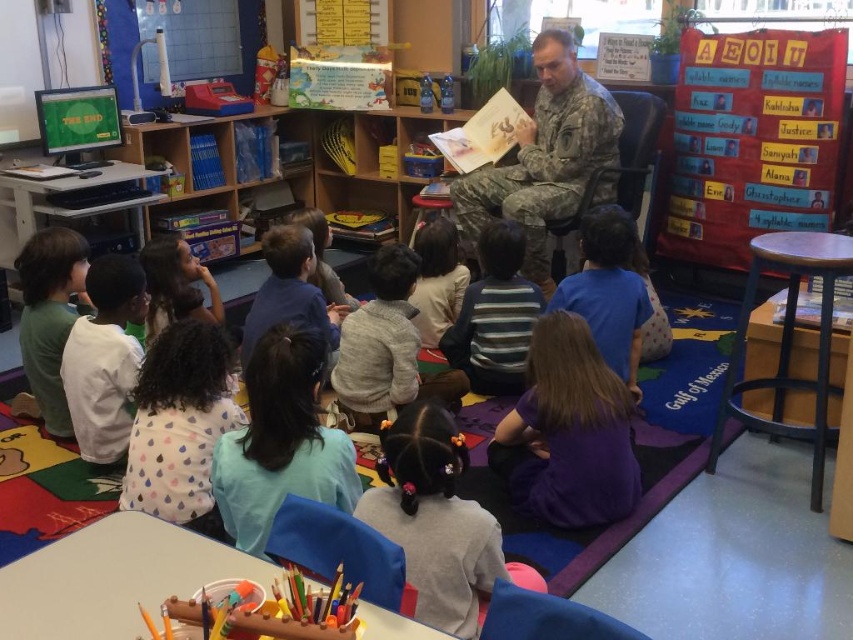
You are a student sitting on the colorful rug with the map of the United States. You need to hand a note to the person reading the book. Which object, the purple fabric at center or the light gray sweater at center, is closer to your right side?

The purple fabric at center is to the right of the light gray sweater at center, so if you are facing the reader, the purple fabric at center would be on your right side.

You are a student in the classroom and want to hand a note to the person wearing the light blue shirt at lower center and the camouflage uniform at center. Which person is closer to you if you are standing at the front of the classroom?

The light blue shirt at lower center is closer to you since it is positioned lower than the camouflage uniform at center, which is further away from the front.